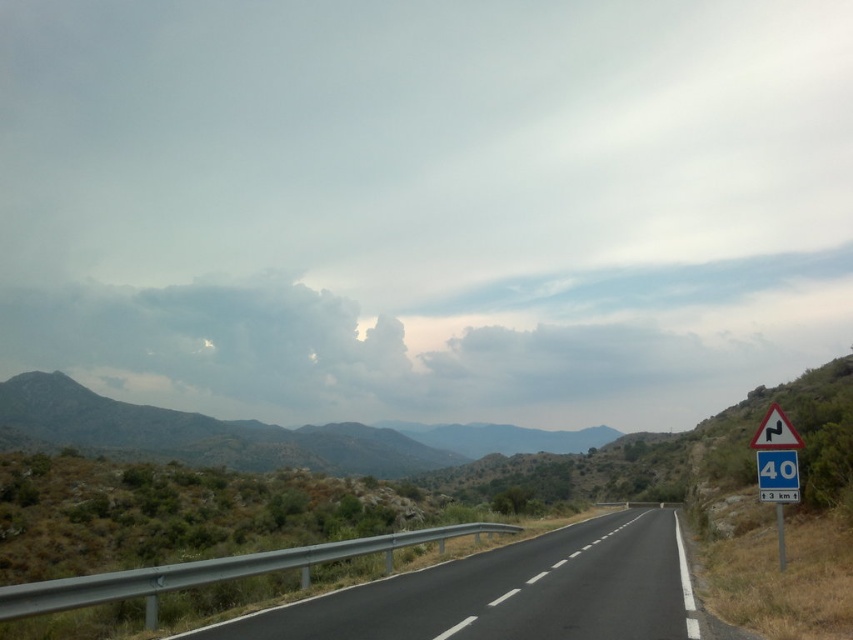
You are standing at the side of the road and want to estimate how far the green textured hillside at center is from you. Based on the scene, can you determine the distance?

The green textured hillside at center is 385.23 feet away from the viewer.

You are a driver approaching a sharp curve on a rural road. You notice two signs on the right side of the road ahead. One is a blue plastic speed limit sign at right, and the other is a white plastic triangle at right. Which of these two signs is shorter?

The blue plastic speed limit sign at right is shorter than the white plastic triangle at right.

You are a hiker standing at the starting point of the trail and see the green textured hillside at center. Which direction should you head to reach the hillside?

The green textured hillside at center is located at point (x=241, y=435), so you should head towards the center of the image to reach it.